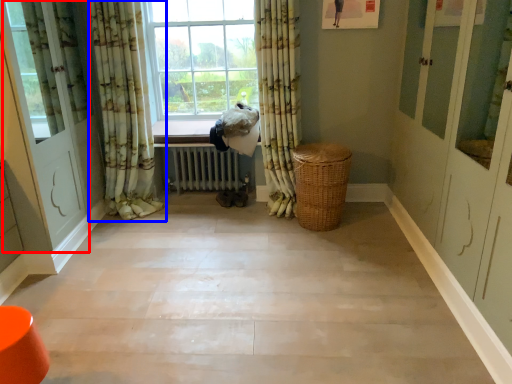
Question: Which object appears closest to the camera in this image, screen door (highlighted by a red box) or curtain (highlighted by a blue box)?

Choices:
 (A) screen door
 (B) curtain

Answer: (A)